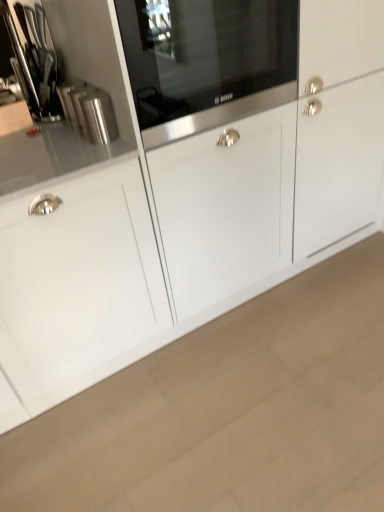
Question: Is polished stainless steel knife block at upper left a part of polished stainless steel canister at left?

Choices:
 (A) yes
 (B) no

Answer: (B)

Question: Can you confirm if polished stainless steel canister at left is shorter than polished stainless steel knife block at upper left?

Choices:
 (A) yes
 (B) no

Answer: (A)

Question: From a real-world perspective, is polished stainless steel canister at left on polished stainless steel knife block at upper left?

Choices:
 (A) no
 (B) yes

Answer: (A)

Question: Is polished stainless steel canister at left in contact with polished stainless steel knife block at upper left?

Choices:
 (A) yes
 (B) no

Answer: (B)

Question: Is polished stainless steel canister at left behind polished stainless steel knife block at upper left?

Choices:
 (A) yes
 (B) no

Answer: (B)

Question: Is polished stainless steel canister at left outside polished stainless steel knife block at upper left?

Choices:
 (A) no
 (B) yes

Answer: (B)

Question: Is stainless steel microwave at center surrounding polished stainless steel canister at left?

Choices:
 (A) yes
 (B) no

Answer: (B)

Question: Considering the relative sizes of stainless steel microwave at center and polished stainless steel canister at left in the image provided, is stainless steel microwave at center bigger than polished stainless steel canister at left?

Choices:
 (A) no
 (B) yes

Answer: (B)

Question: Can you confirm if stainless steel microwave at center is positioned to the left of polished stainless steel canister at left?

Choices:
 (A) yes
 (B) no

Answer: (B)

Question: Is stainless steel microwave at center wider than polished stainless steel canister at left?

Choices:
 (A) no
 (B) yes

Answer: (B)

Question: Is stainless steel microwave at center at the right side of polished stainless steel canister at left?

Choices:
 (A) no
 (B) yes

Answer: (B)

Question: Are stainless steel microwave at center and polished stainless steel canister at left located far from each other?

Choices:
 (A) yes
 (B) no

Answer: (B)

Question: Does polished stainless steel canister at left have a greater height compared to stainless steel microwave at center?

Choices:
 (A) no
 (B) yes

Answer: (A)